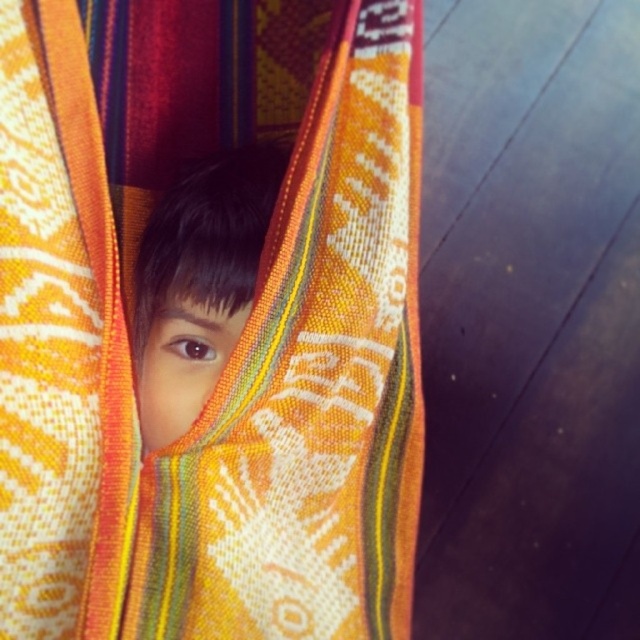
Question: Among these objects, which one is nearest to the camera?

Choices:
 (A) smooth skin face at center
 (B) textured woven fabric at center

Answer: (B)

Question: Where is textured woven fabric at center located in relation to smooth skin face at center in the image?

Choices:
 (A) right
 (B) left

Answer: (A)

Question: Is textured woven fabric at center positioned before smooth skin face at center?

Choices:
 (A) no
 (B) yes

Answer: (B)

Question: Is textured woven fabric at center closer to the viewer compared to smooth skin face at center?

Choices:
 (A) yes
 (B) no

Answer: (A)

Question: Which object appears closest to the camera in this image?

Choices:
 (A) smooth skin face at center
 (B) textured woven fabric at center

Answer: (B)